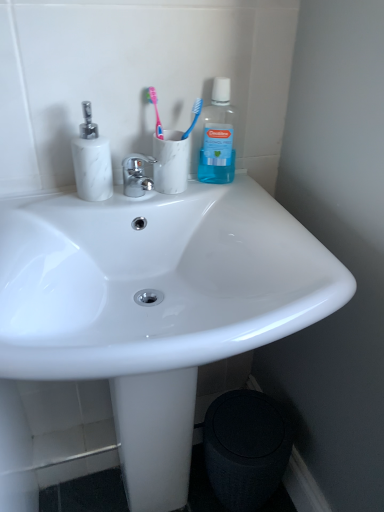
Locate an element on the screen. free space in front of white marble soap dispenser at left is located at coordinates (66, 213).